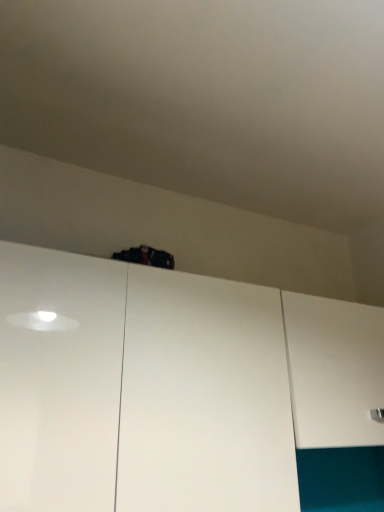
Question: Is point (281, 318) positioned closer to the camera than point (339, 329)?

Choices:
 (A) farther
 (B) closer

Answer: (B)

Question: Is white matte cabinet at upper center, which is the 1th cabinetry from left to right, situated inside white matte cabinet at center, which appears as the 2th cabinetry when viewed from the left, or outside?

Choices:
 (A) inside
 (B) outside

Answer: (B)

Question: Is white matte cabinet at upper center, the second cabinetry in the right-to-left sequence, in front of or behind white matte cabinet at center, arranged as the first cabinetry when viewed from the right, in the image?

Choices:
 (A) front
 (B) behind

Answer: (A)

Question: Is white matte cabinet at center, which appears as the 2th cabinetry when viewed from the left, spatially inside white matte cabinet at upper center, the second cabinetry in the right-to-left sequence, or outside of it?

Choices:
 (A) inside
 (B) outside

Answer: (B)

Question: Is white matte cabinet at center, arranged as the first cabinetry when viewed from the right, taller or shorter than white matte cabinet at upper center, which is the 1th cabinetry from left to right?

Choices:
 (A) short
 (B) tall

Answer: (A)

Question: Looking at the image, does white matte cabinet at center, which appears as the 2th cabinetry when viewed from the left, seem bigger or smaller compared to white matte cabinet at upper center, which is the 1th cabinetry from left to right?

Choices:
 (A) big
 (B) small

Answer: (B)

Question: From a real-world perspective, is white matte cabinet at center, arranged as the first cabinetry when viewed from the right, physically located above or below white matte cabinet at upper center, which is the 1th cabinetry from left to right?

Choices:
 (A) below
 (B) above

Answer: (B)